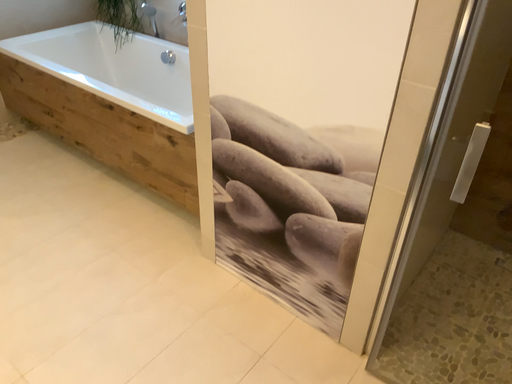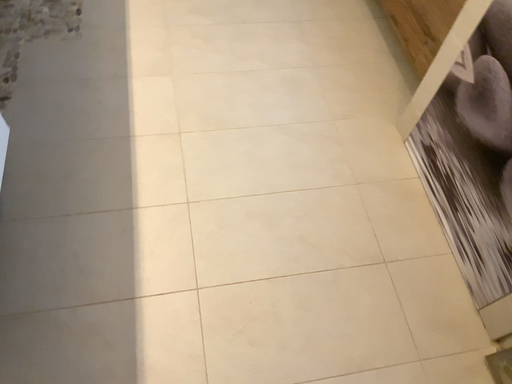
Question: Which way did the camera rotate in the video?

Choices:
 (A) rotated right
 (B) rotated left

Answer: (B)